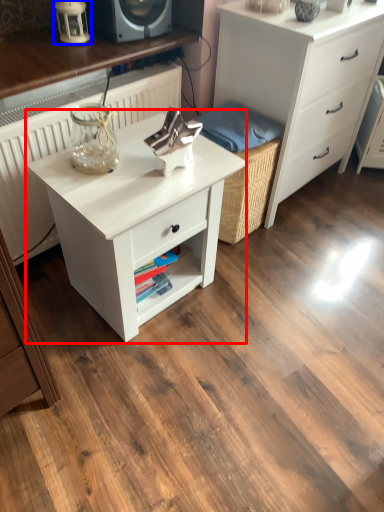
Question: Which object appears closest to the camera in this image, nightstand (highlighted by a red box) or table lamp (highlighted by a blue box)?

Choices:
 (A) nightstand
 (B) table lamp

Answer: (A)